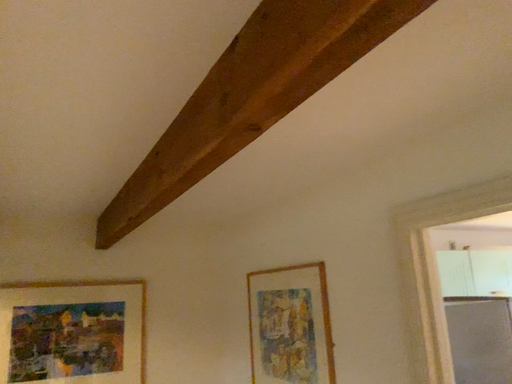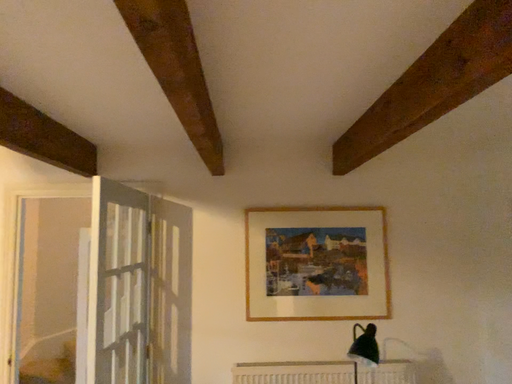
Question: How did the camera likely rotate when shooting the video?

Choices:
 (A) rotated upward
 (B) rotated downward

Answer: (B)